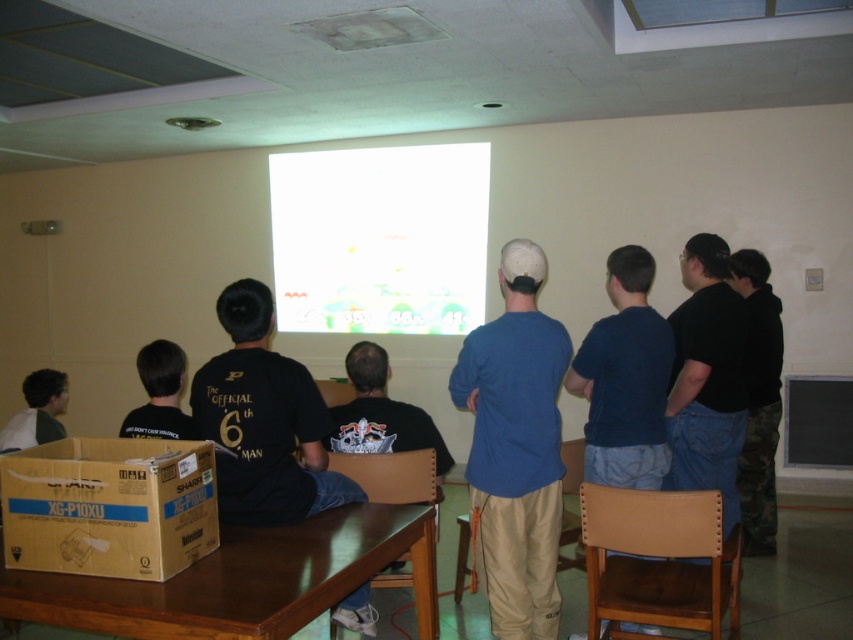
Is white glossy projection screen at center thinner than black cotton hoodie at right?

Incorrect, white glossy projection screen at center's width is not less than black cotton hoodie at right's.

Is white glossy projection screen at center wider than black cotton hoodie at right?

Indeed, white glossy projection screen at center has a greater width compared to black cotton hoodie at right.

Which is behind, point (376, 195) or point (757, 390)?

Point (376, 195)

Identify the location of white glossy projection screen at center. The image size is (853, 640). (380, 237).

Is blue cotton shirt at center bigger than dark blue t-shirt at center?

Yes.

Who is more distant from viewer, [525,314] or [646,467]?

Point [646,467]

Identify the location of blue cotton shirt at center. This screenshot has height=640, width=853. (515, 448).

Does white glossy projection screen at center appear on the right side of dark blue t-shirt at center?

Incorrect, white glossy projection screen at center is not on the right side of dark blue t-shirt at center.

This screenshot has width=853, height=640. I want to click on white glossy projection screen at center, so click(x=380, y=237).